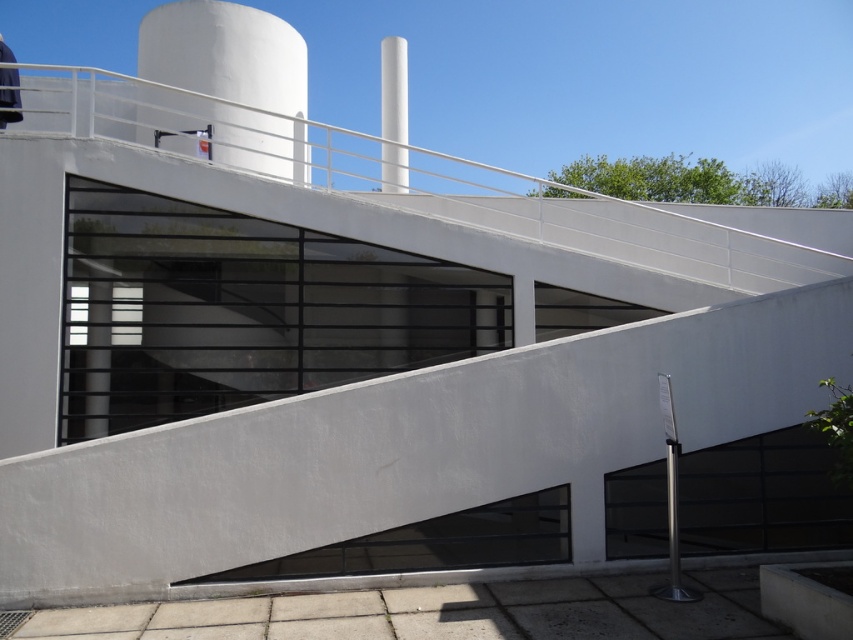
Does white smooth water tower at upper center have a lesser height compared to white smooth pillar at upper center?

Yes, white smooth water tower at upper center is shorter than white smooth pillar at upper center.

Can you confirm if white smooth water tower at upper center is smaller than white smooth pillar at upper center?

Yes.

Is point (148, 12) farther from camera compared to point (399, 88)?

Yes, point (148, 12) is farther from viewer.

In order to click on white smooth water tower at upper center in this screenshot , I will do `click(225, 52)`.